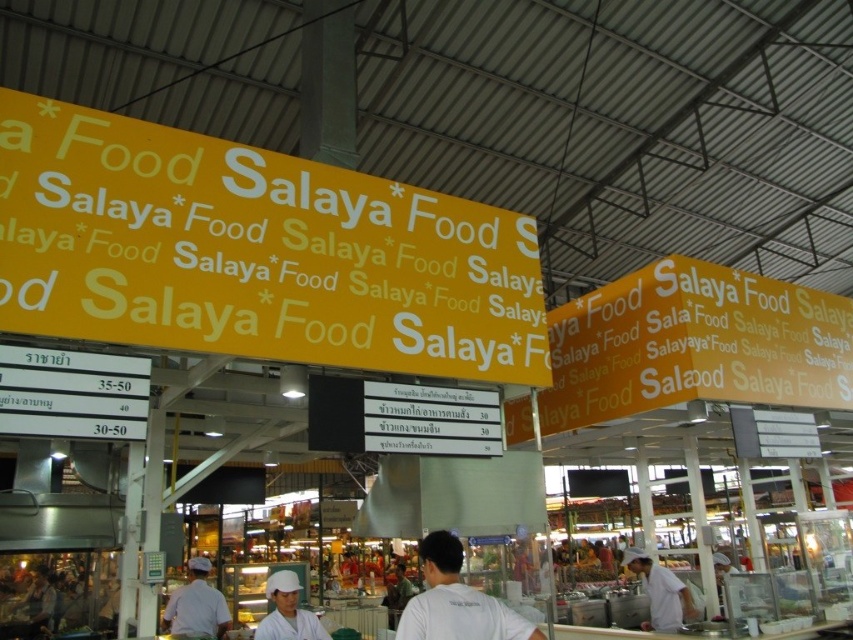
Does yellow matte signboard at upper center have a lesser height compared to white matte chef hat at center?

No, yellow matte signboard at upper center is not shorter than white matte chef hat at center.

Measure the distance between point (x=196, y=300) and camera.

The distance of point (x=196, y=300) from camera is 4.29 meters.

Where is `yellow matte signboard at upper center`? The width and height of the screenshot is (853, 640). yellow matte signboard at upper center is located at coordinates (254, 252).

In the scene shown: Can you confirm if yellow fabric sign at upper center is positioned to the right of white uniform at lower right?

Yes, yellow fabric sign at upper center is to the right of white uniform at lower right.

Does yellow fabric sign at upper center appear under white uniform at lower right?

Actually, yellow fabric sign at upper center is above white uniform at lower right.

Who is more forward, (606, 380) or (672, 598)?

Positioned in front is point (606, 380).

The width and height of the screenshot is (853, 640). I want to click on yellow fabric sign at upper center, so click(x=694, y=344).

Measure the distance between yellow fabric sign at upper center and white matte shirt at center.

They are 4.45 meters apart.

Which of these two, yellow fabric sign at upper center or white matte shirt at center, stands taller?

With more height is yellow fabric sign at upper center.

You are a GUI agent. You are given a task and a screenshot of the screen. Output one action in this format:
    pyautogui.click(x=<x>, y=<y>)
    Task: Click on the yellow fabric sign at upper center
    This screenshot has width=853, height=640.
    Given the screenshot: What is the action you would take?
    pyautogui.click(x=694, y=344)

This screenshot has height=640, width=853. Identify the location of yellow fabric sign at upper center. (694, 344).